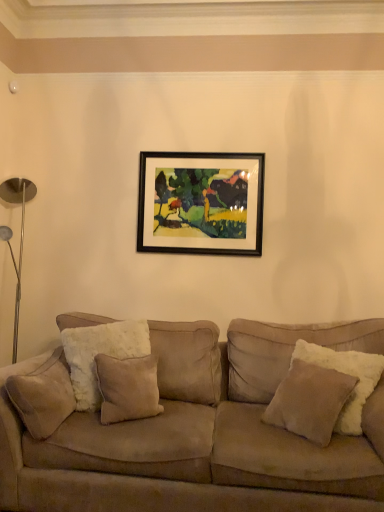
Question: In terms of size, does suede/velvet pillow at left, the second pillow when ordered from right to left, appear bigger or smaller than beige suede pillow at right, the 1th pillow when ordered from right to left?

Choices:
 (A) big
 (B) small

Answer: (A)

Question: Considering the positions of suede/velvet pillow at left, the second pillow when ordered from right to left, and beige suede pillow at right, the 1th pillow when ordered from right to left, in the image, is suede/velvet pillow at left, the second pillow when ordered from right to left, wider or thinner than beige suede pillow at right, the 1th pillow when ordered from right to left,?

Choices:
 (A) thin
 (B) wide

Answer: (A)

Question: Which object is positioned farthest from the beige suede pillow at right, the 1th pillow when ordered from right to left?

Choices:
 (A) black framed painting at upper center
 (B) suede couch at center
 (C) suede/velvet pillow at left, the second pillow when ordered from right to left

Answer: (C)

Question: Which object is the farthest from the suede couch at center?

Choices:
 (A) black framed painting at upper center
 (B) beige suede pillow at right, the 1th pillow when ordered from right to left
 (C) suede/velvet pillow at left, the second pillow when ordered from right to left

Answer: (A)